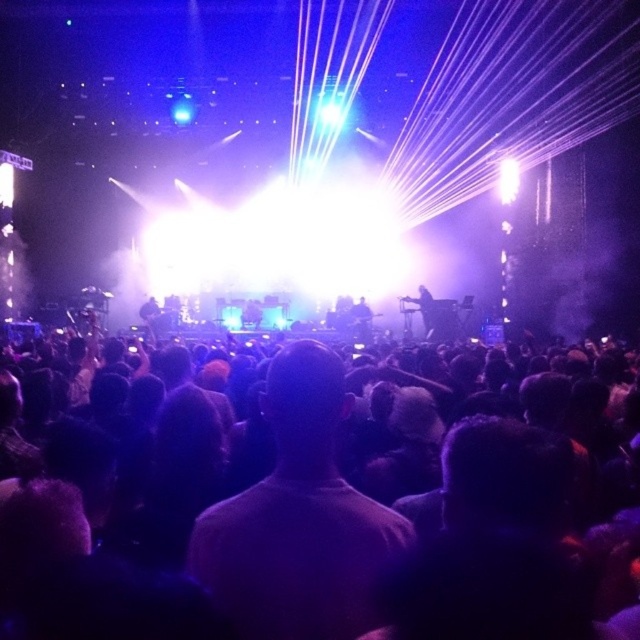
You are a stagehand who needs to move a 50 feet long extension cord from the black matte crowd at center to the black matte guitar at center. Can you safely stretch the cord between them without it being too short?

The distance between the black matte crowd at center and the black matte guitar at center is 51.49 feet. Since the extension cord is only 50 feet long, it would be 1.49 feet too short to reach between them safely.

You are a stagehand at the concert and need to ensure the black matte guitar at center is visible to the audience. Considering the black matte crowd at center is in front of it, will the guitar be obscured by the crowd?

The black matte crowd at center has a lesser height compared to black matte guitar at center, so the guitar will not be obscured by the crowd since it is taller than the crowd.